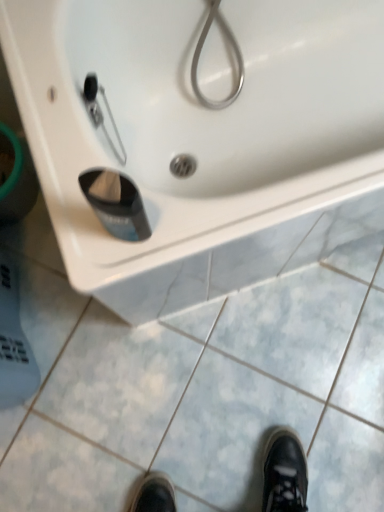
Question: Considering the positions of point (89, 176) and point (329, 287), is point (89, 176) closer or farther from the camera than point (329, 287)?

Choices:
 (A) farther
 (B) closer

Answer: (B)

Question: Is black plastic cup at lower center to the left or to the right of white glossy sink at upper center in the image?

Choices:
 (A) right
 (B) left

Answer: (B)

Question: Considering the real-world distances, which object is farthest from the white glossy sink at upper center?

Choices:
 (A) white glossy sink at upper center
 (B) black plastic cup at lower center

Answer: (A)

Question: Estimate the real-world distances between objects in this image. Which object is farther from the black plastic cup at lower center?

Choices:
 (A) white glossy sink at upper center
 (B) white glossy sink at upper center

Answer: (B)